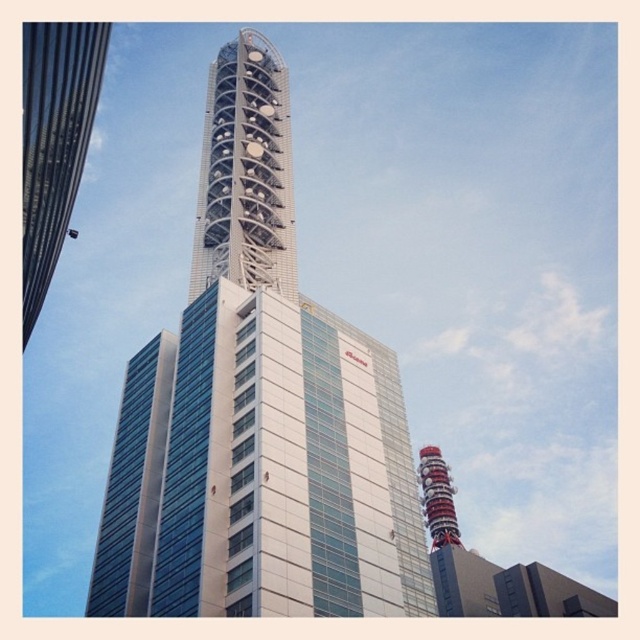
You are an architect evaluating the urban skyline. Which structure, the white metallic tower at center or the glassy steel skyscraper at left, has a greater vertical height?

The white metallic tower at center is much taller than the glassy steel skyscraper at left, so it has a greater vertical height.

You are a drone operator trying to capture a photo of the white glass tower at center. Your drone is currently at coordinates point 0.6, 0.4. To ensure the tower is centered in your shot, should you adjust your position to the left or right?

The white glass tower at center is located at point [257,412], so you should move your drone slightly to the right from point [256,384] to center the tower in your shot.

You are an architect evaluating the urban layout. Which of the two structures, the white glass tower at center or the glassy steel skyscraper at left, has a greater width?

The white glass tower at center has a greater width than the glassy steel skyscraper at left according to the description.